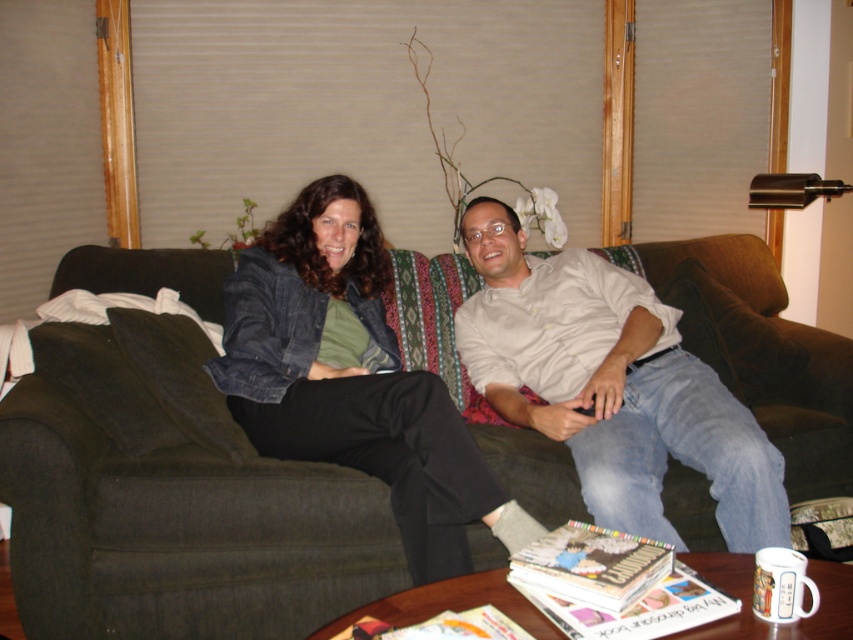
You are trying to decide whether to place a new decorative item on the sofa. The sofa currently has the light beige shirt at center and the matte paper magazine at center. Which object takes up more space on the sofa?

The light beige shirt at center is larger in size than the matte paper magazine at center, so it takes up more space on the sofa.

You are a delivery person who needs to place a small package on the dark green fabric couch at center without disturbing the matte paper magazine at center. Can you fit the package between them if the package is 28 inches long?

The dark green fabric couch at center is 29.02 inches away from the matte paper magazine at center. Since the package is 28 inches long, it can fit between them as there is enough space.